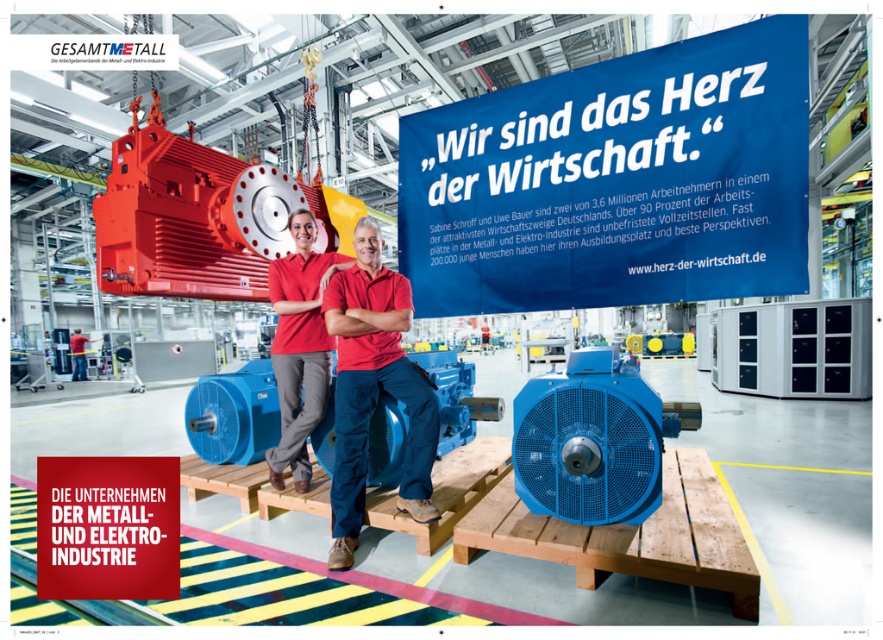
In the scene shown: Is red fabric shirt at center thinner than red smooth shirt at center?

No, red fabric shirt at center is not thinner than red smooth shirt at center.

Does red fabric shirt at center appear on the left side of red smooth shirt at center?

No, red fabric shirt at center is not to the left of red smooth shirt at center.

Does point (338, 412) come closer to viewer compared to point (299, 243)?

Yes.

Where is `red fabric shirt at center`? red fabric shirt at center is located at coordinates (374, 388).